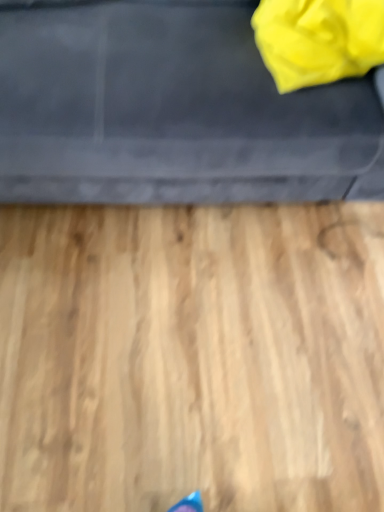
Question: Is yellow fabric bag at upper right wider or thinner than matte black sofa at upper center?

Choices:
 (A) wide
 (B) thin

Answer: (B)

Question: Considering the relative positions of yellow fabric bag at upper right and matte black sofa at upper center in the image provided, is yellow fabric bag at upper right to the left or to the right of matte black sofa at upper center?

Choices:
 (A) left
 (B) right

Answer: (B)

Question: From the image's perspective, is yellow fabric bag at upper right located above or below matte black sofa at upper center?

Choices:
 (A) below
 (B) above

Answer: (A)

Question: Considering the positions of matte black sofa at upper center and yellow fabric bag at upper right in the image, is matte black sofa at upper center bigger or smaller than yellow fabric bag at upper right?

Choices:
 (A) big
 (B) small

Answer: (A)

Question: Considering the positions of matte black sofa at upper center and yellow fabric bag at upper right in the image, is matte black sofa at upper center taller or shorter than yellow fabric bag at upper right?

Choices:
 (A) tall
 (B) short

Answer: (A)

Question: From a real-world perspective, relative to yellow fabric bag at upper right, is matte black sofa at upper center vertically above or below?

Choices:
 (A) below
 (B) above

Answer: (A)

Question: Considering the positions of point (96, 14) and point (289, 88), is point (96, 14) closer or farther from the camera than point (289, 88)?

Choices:
 (A) closer
 (B) farther

Answer: (B)